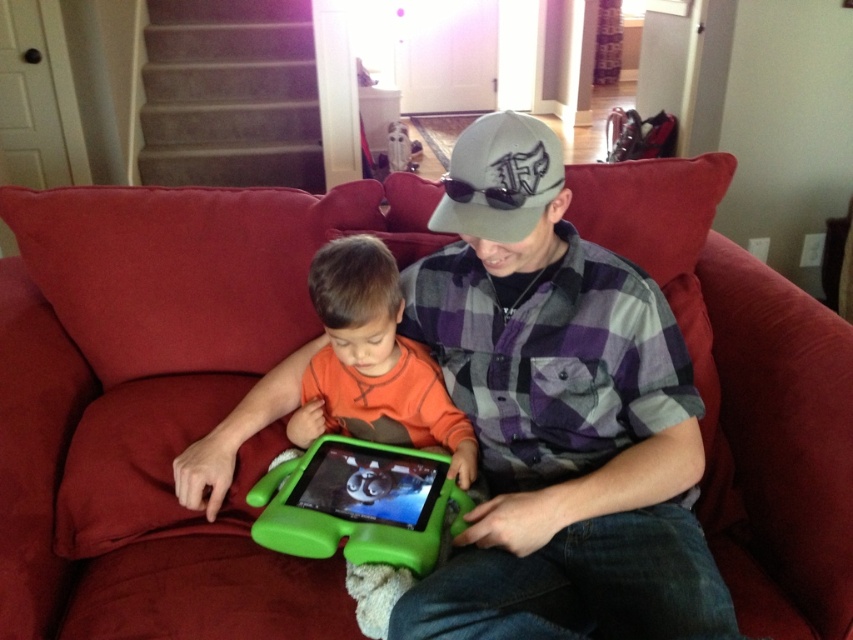
Question: Estimate the real-world distances between objects in this image. Which object is closer to the gray fabric baseball cap at center?

Choices:
 (A) orange soft shirt at center
 (B) green plastic tablet at center

Answer: (A)

Question: Can you confirm if orange soft shirt at center is thinner than gray fabric baseball cap at center?

Choices:
 (A) yes
 (B) no

Answer: (B)

Question: Which object is closer to the camera taking this photo?

Choices:
 (A) orange soft shirt at center
 (B) green plastic tablet at center

Answer: (B)

Question: Considering the relative positions of orange soft shirt at center and gray fabric baseball cap at center in the image provided, where is orange soft shirt at center located with respect to gray fabric baseball cap at center?

Choices:
 (A) above
 (B) below

Answer: (B)

Question: Is orange soft shirt at center wider than green plastic tablet at center?

Choices:
 (A) no
 (B) yes

Answer: (B)

Question: Which point is farther to the camera?

Choices:
 (A) (392, 483)
 (B) (465, 140)

Answer: (A)